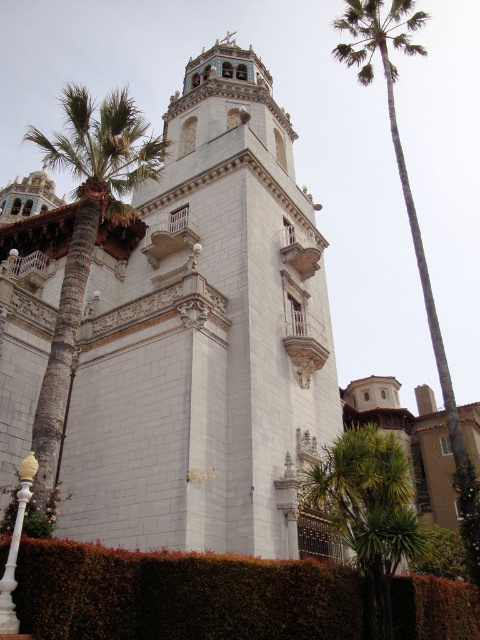
Locate an element on the screen. The width and height of the screenshot is (480, 640). green leafy hedge at lower center is located at coordinates (180, 595).

Is the position of green leafy hedge at lower center less distant than that of green leafy palm tree at left?

Yes, green leafy hedge at lower center is closer to the viewer.

Which is in front, point (408, 577) or point (56, 320)?

Point (408, 577) is more forward.

Where is `green leafy hedge at lower center`? The image size is (480, 640). green leafy hedge at lower center is located at coordinates (180, 595).

Can you confirm if white stone tower at center is positioned above green leafy palm tree at right?

Yes, white stone tower at center is above green leafy palm tree at right.

Between white stone tower at center and green leafy palm tree at right, which one is positioned lower?

green leafy palm tree at right

Does point (269, 268) come closer to viewer compared to point (386, 102)?

Yes, point (269, 268) is closer to viewer.

At what (x,y) coordinates should I click in order to perform the action: click on white stone tower at center. Please return your answer as a coordinate pair (x, y). Looking at the image, I should click on (205, 339).

Is green leafy palm tree at left bigger than green leafy palm tree at lower right?

Correct, green leafy palm tree at left is larger in size than green leafy palm tree at lower right.

Which is behind, point (82, 172) or point (380, 621)?

The point (82, 172) is more distant.

Image resolution: width=480 pixels, height=640 pixels. I want to click on green leafy palm tree at left, so click(x=84, y=237).